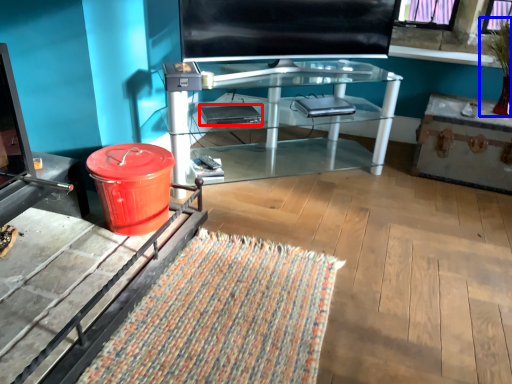
Question: Which object is closer to the camera taking this photo, laptop (highlighted by a red box) or houseplant (highlighted by a blue box)?

Choices:
 (A) laptop
 (B) houseplant

Answer: (B)